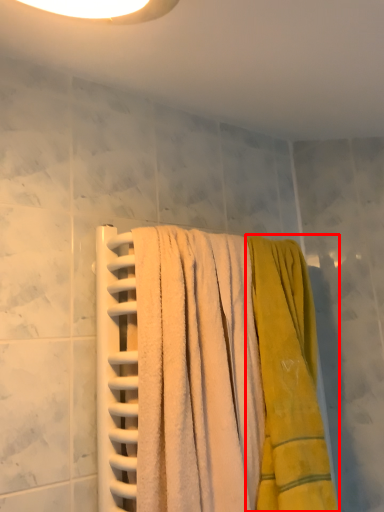
Question: From the image's perspective, where is towel (annotated by the red box) located relative to towel?

Choices:
 (A) below
 (B) above

Answer: (A)